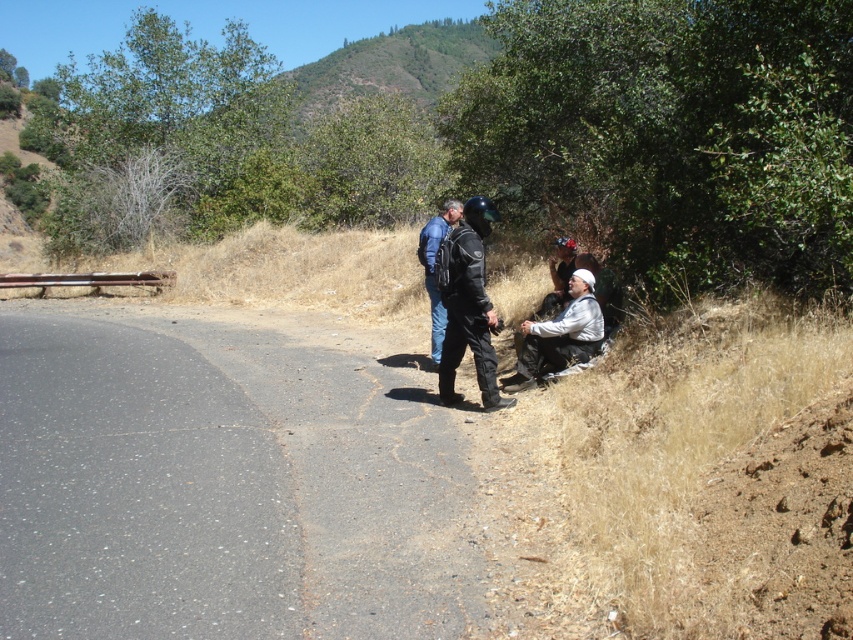
You are a hiker standing on the paved road and see the white matte jacket at lower right and the matte black jacket at center. Which jacket is closer to the ground?

The white matte jacket at lower right is located below matte black jacket at center, so it is closer to the ground.